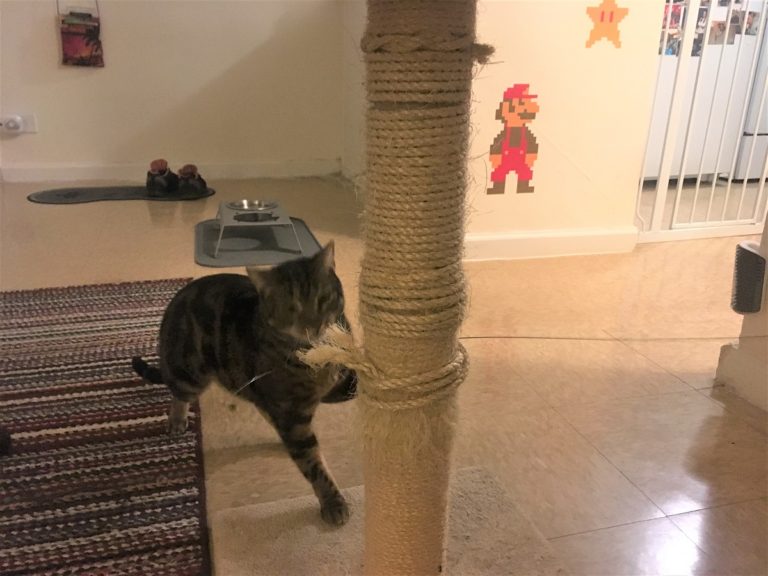
In order to click on cat food and water bowls and tray in this screenshot , I will do `click(240, 211)`.